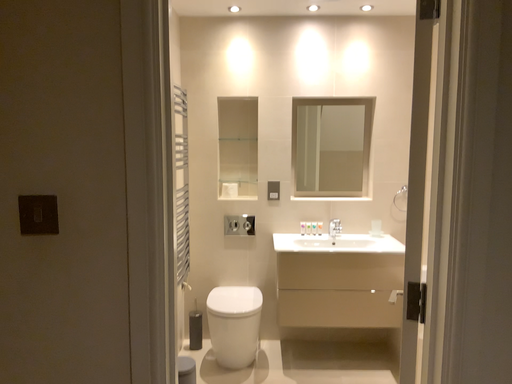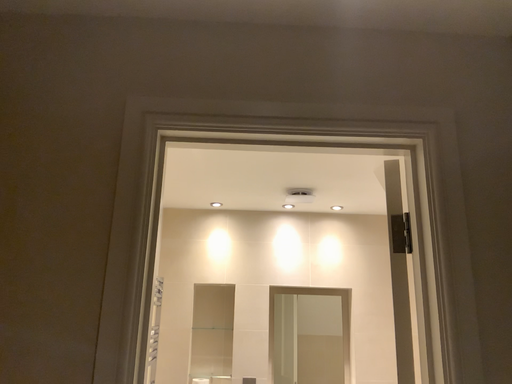
Question: Which way did the camera rotate in the video?

Choices:
 (A) rotated downward
 (B) rotated upward

Answer: (B)